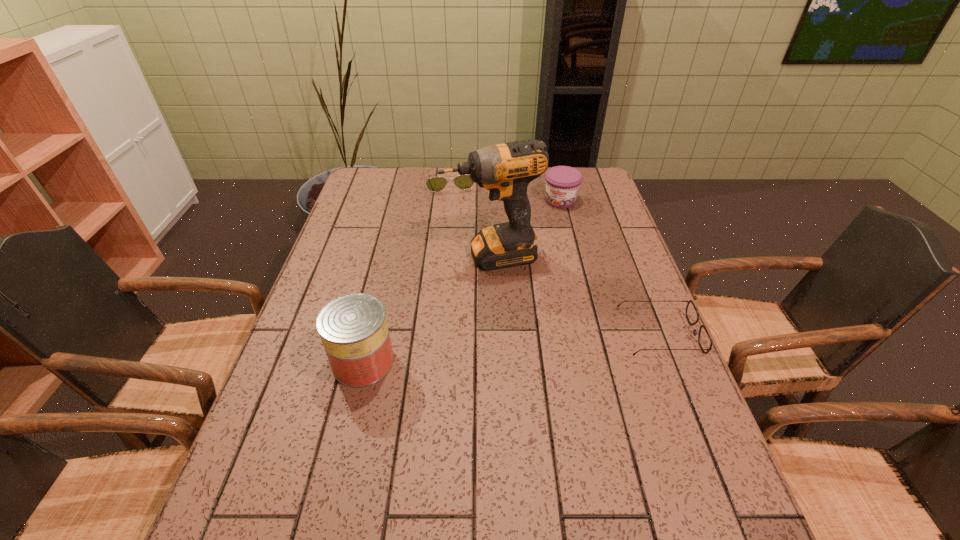
Where is `object positioned at the left edge`? Image resolution: width=960 pixels, height=540 pixels. object positioned at the left edge is located at coordinates (353, 328).

This screenshot has width=960, height=540. In order to click on sunglasses located at the right edge in this screenshot , I will do `click(704, 339)`.

Where is `jam at the right edge`? jam at the right edge is located at coordinates (562, 182).

Where is `object present at the far right corner`? The width and height of the screenshot is (960, 540). object present at the far right corner is located at coordinates (562, 182).

The image size is (960, 540). Identify the location of vacant space at the far edge of the desktop. (542, 197).

At what (x,y) coordinates should I click in order to perform the action: click on free space at the near edge. Please return your answer as a coordinate pair (x, y). This screenshot has height=540, width=960. Looking at the image, I should click on (443, 451).

Find the location of a particular element. The image size is (960, 540). vacant space at the left edge of the desktop is located at coordinates (372, 237).

Locate an element on the screen. This screenshot has width=960, height=540. blank space at the right edge of the desktop is located at coordinates (645, 291).

Identify the location of vacant space at the far left corner. The width and height of the screenshot is (960, 540). (384, 174).

At what (x,y) coordinates should I click in order to perform the action: click on vacant space at the near right corner of the desktop. Please return your answer as a coordinate pair (x, y). The image size is (960, 540). Looking at the image, I should click on (657, 477).